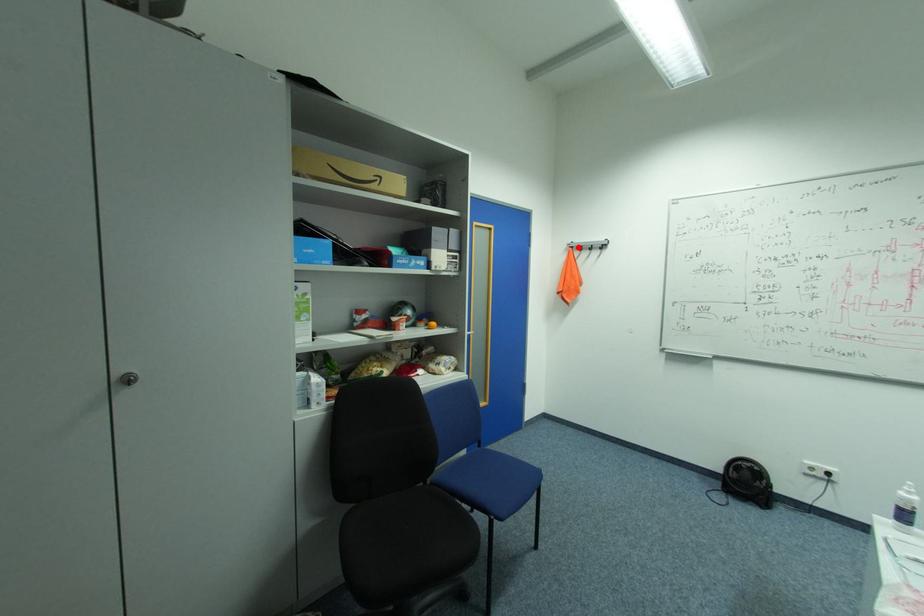
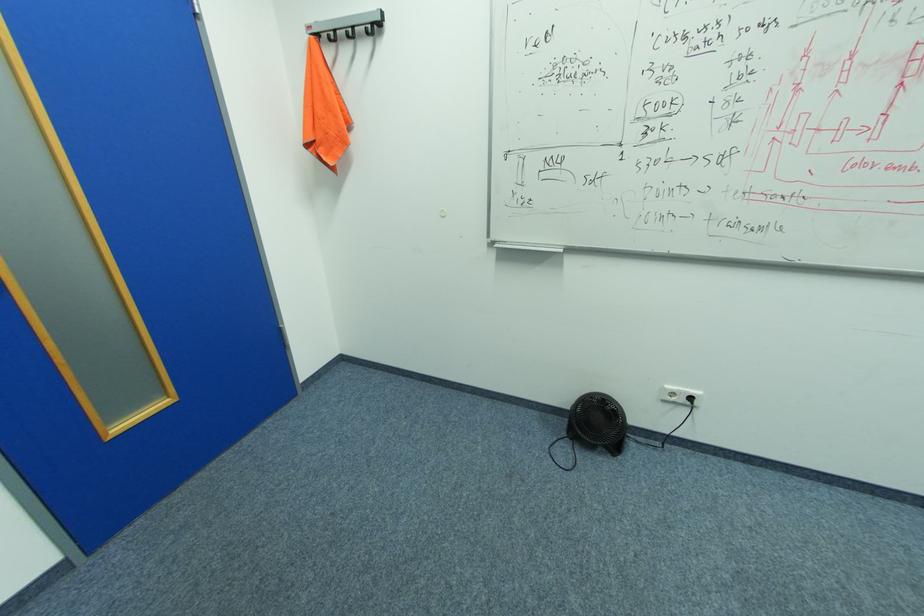
The point at the highlighted location is marked in the first image. Where is the corresponding point in the second image?

(324, 34)